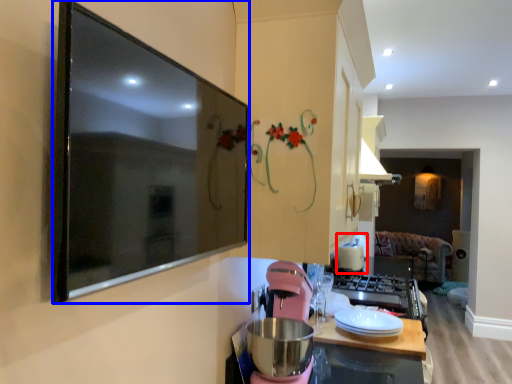
Question: Among these objects, which one is farthest to the camera, appliance (highlighted by a red box) or picture frame (highlighted by a blue box)?

Choices:
 (A) appliance
 (B) picture frame

Answer: (A)